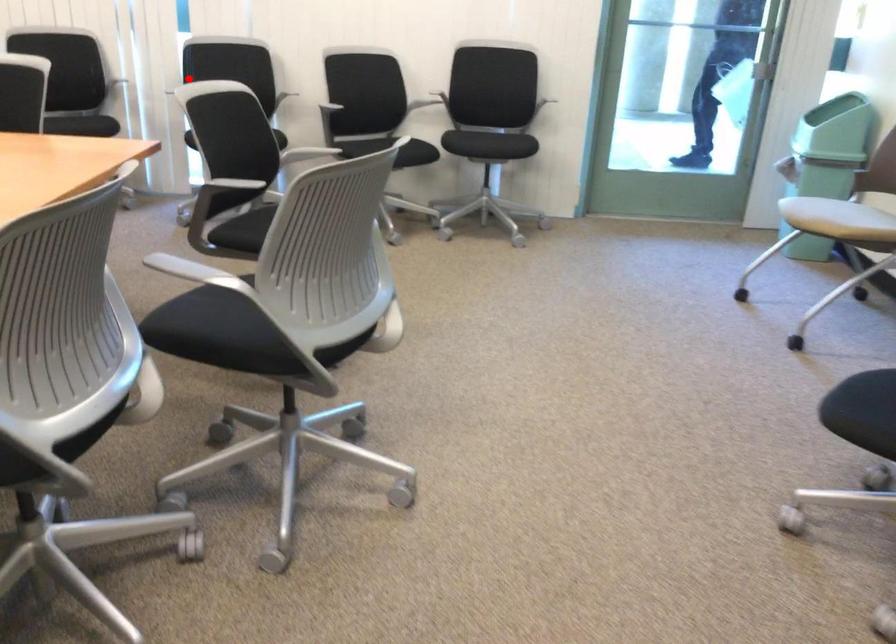
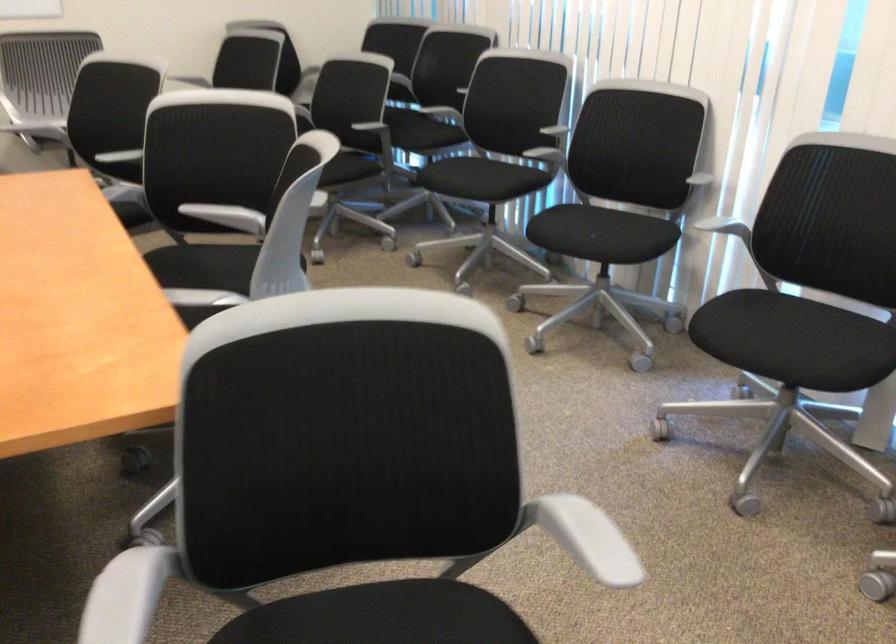
The point at the highlighted location is marked in the first image. Where is the corresponding point in the second image?

(725, 228)